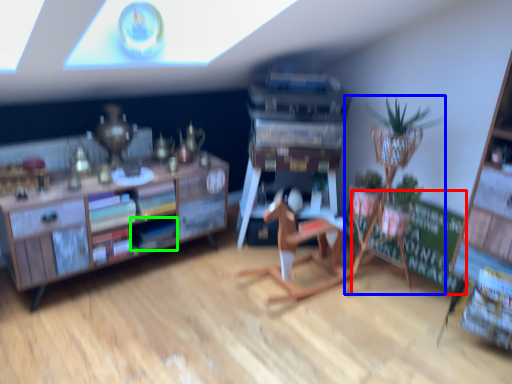
Question: Which is nearer to the bulletin board (highlighted by a red box)? houseplant (highlighted by a blue box) or book (highlighted by a green box).

Choices:
 (A) houseplant
 (B) book

Answer: (A)